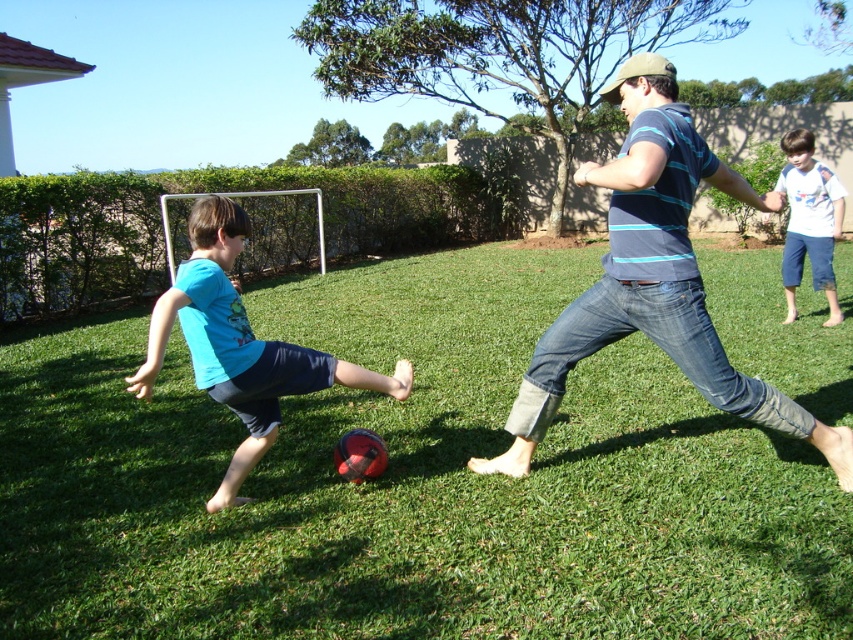
Can you confirm if blue striped shirt at center is positioned below blue matte shirt at lower left?

No.

Between blue striped shirt at center and blue matte shirt at lower left, which one appears on the left side from the viewer's perspective?

blue matte shirt at lower left is more to the left.

Is point (666, 77) in front of point (235, 476)?

Yes, point (666, 77) is in front of point (235, 476).

I want to click on blue striped shirt at center, so click(654, 276).

Is green grass at center positioned at the back of white cotton shirt at upper right?

No, it is in front of white cotton shirt at upper right.

Between green grass at center and white cotton shirt at upper right, which one has less height?

Standing shorter between the two is green grass at center.

The image size is (853, 640). I want to click on green grass at center, so click(x=408, y=483).

Which of these two, blue striped shirt at center or white cotton shirt at upper right, stands shorter?

With less height is white cotton shirt at upper right.

Is point (622, 204) less distant than point (833, 196)?

That is True.

Locate an element on the screen. Image resolution: width=853 pixels, height=640 pixels. blue striped shirt at center is located at coordinates (654, 276).